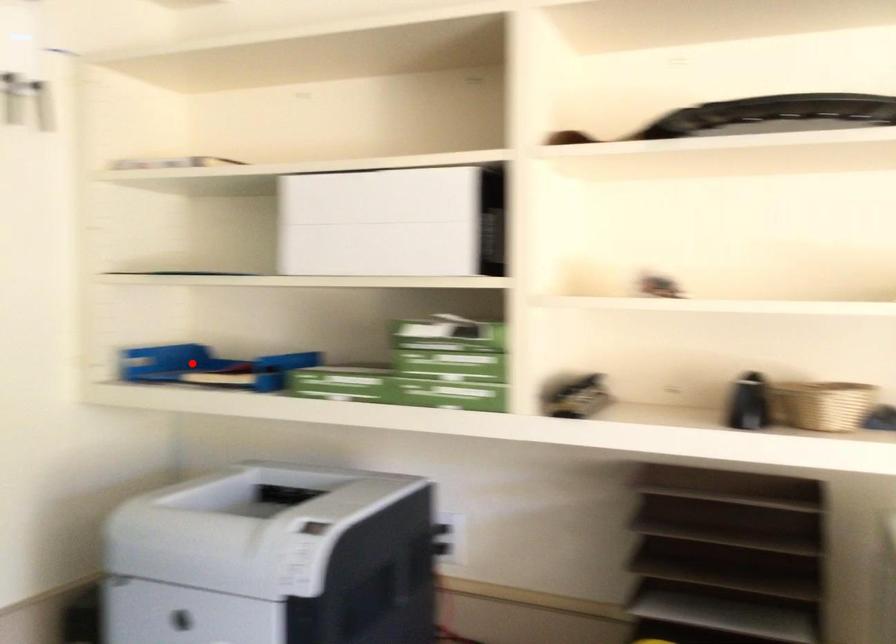
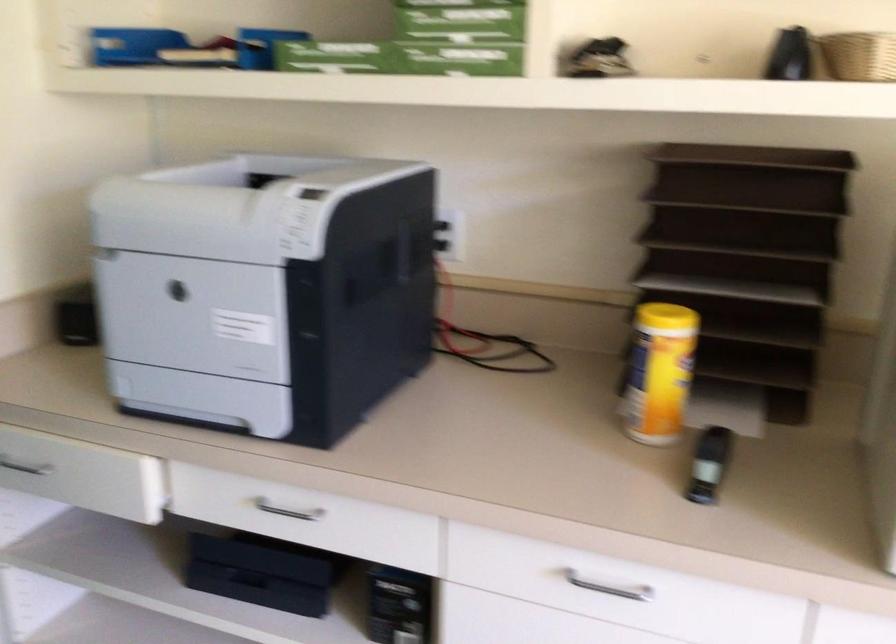
Find the pixel in the second image that matches the highlighted location in the first image.

(165, 49)